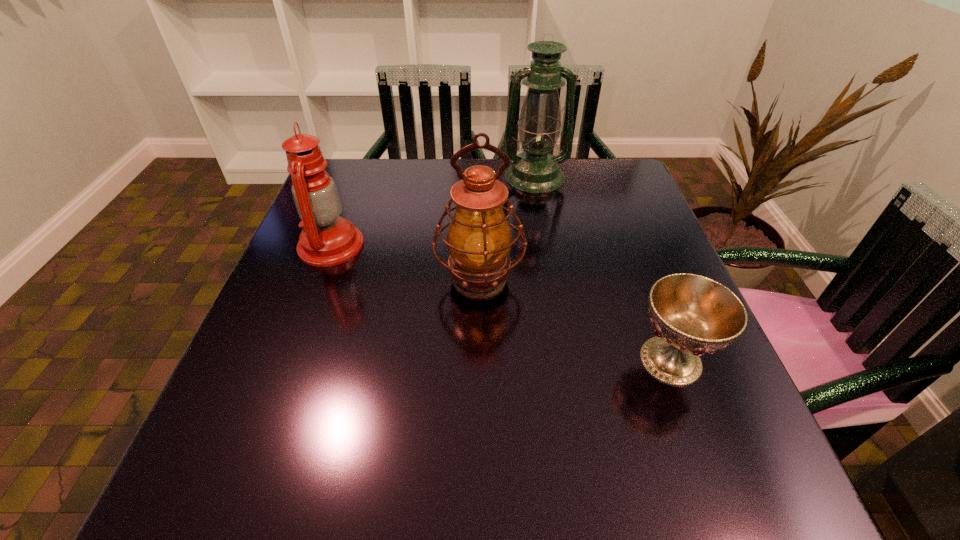
Identify the location of vacant space in between the shortest object and the farthest object. This screenshot has height=540, width=960. (603, 268).

Identify the location of blank region between the leftmost object and the farthest oil lamp. (433, 211).

Find the location of a particular element. free area in between the chalice and the farthest object is located at coordinates (603, 268).

Where is `empty location between the farthest object and the leftmost object`? This screenshot has width=960, height=540. empty location between the farthest object and the leftmost object is located at coordinates (433, 211).

Select which object appears as the second closest to the farthest object. Please provide its 2D coordinates. Your answer should be formatted as a tuple, i.e. [(x, y)], where the tuple contains the x and y coordinates of a point satisfying the conditions above.

[(327, 239)]

Locate which object is the third closest to the shortest object. Please provide its 2D coordinates. Your answer should be formatted as a tuple, i.e. [(x, y)], where the tuple contains the x and y coordinates of a point satisfying the conditions above.

[(327, 239)]

Locate which oil lamp ranks in proximity to the farthest oil lamp. Please provide its 2D coordinates. Your answer should be formatted as a tuple, i.e. [(x, y)], where the tuple contains the x and y coordinates of a point satisfying the conditions above.

[(479, 239)]

Point out which oil lamp is positioned as the second nearest to the rightmost object. Please provide its 2D coordinates. Your answer should be formatted as a tuple, i.e. [(x, y)], where the tuple contains the x and y coordinates of a point satisfying the conditions above.

[(535, 170)]

This screenshot has height=540, width=960. Find the location of `free point that satisfies the following two spatial constraints: 1. on the back side of the leftmost oil lamp; 2. on the left side of the farthest oil lamp`. free point that satisfies the following two spatial constraints: 1. on the back side of the leftmost oil lamp; 2. on the left side of the farthest oil lamp is located at coordinates (356, 177).

Locate an element on the screen. vacant space that satisfies the following two spatial constraints: 1. on the back side of the leftmost oil lamp; 2. on the right side of the farthest oil lamp is located at coordinates (356, 177).